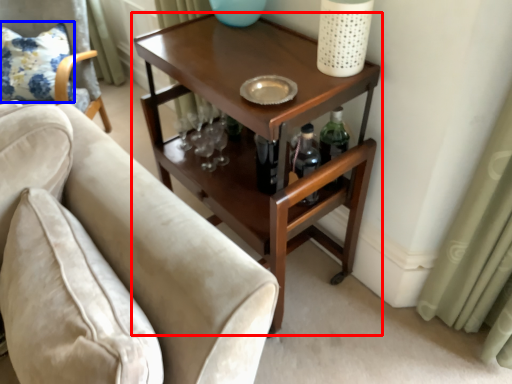
Question: Which object appears farthest to the camera in this image, table (highlighted by a red box) or pillow (highlighted by a blue box)?

Choices:
 (A) table
 (B) pillow

Answer: (B)